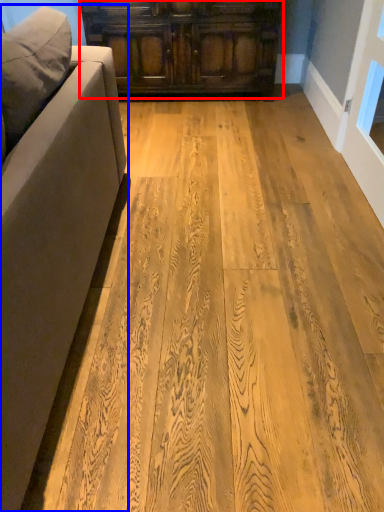
Question: Which point is further to the camera, cabinetry (highlighted by a red box) or studio couch (highlighted by a blue box)?

Choices:
 (A) cabinetry
 (B) studio couch

Answer: (A)